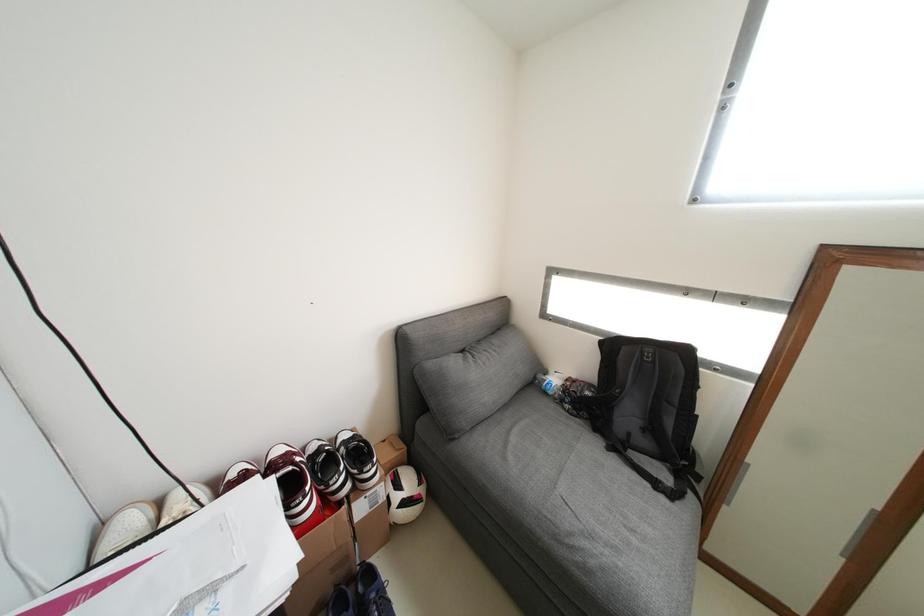
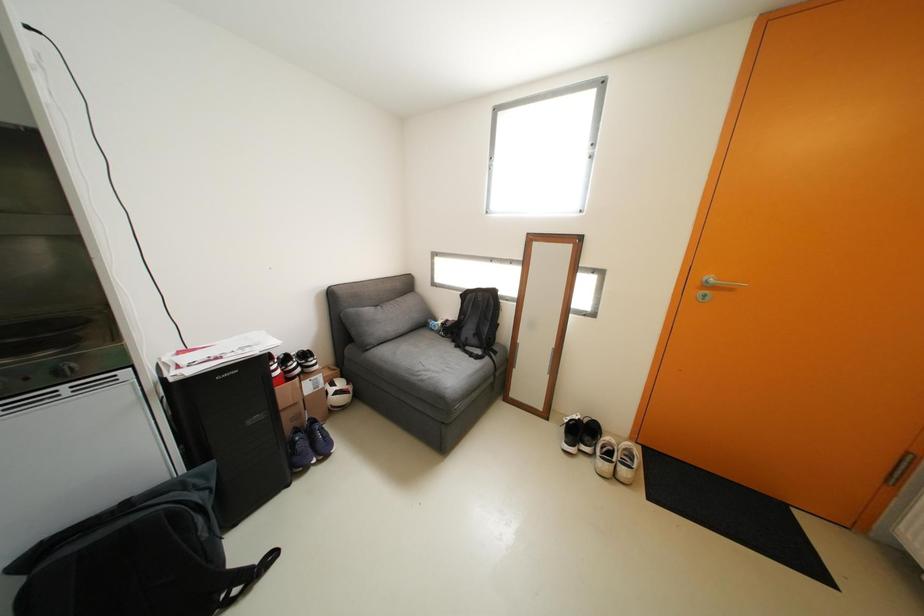
Question: The camera is either moving clockwise (left) or counter-clockwise (right) around the object. The first image is from the beginning of the video and the second image is from the end. Is the camera moving left or right when shooting the video?

Choices:
 (A) Left
 (B) Right

Answer: (A)